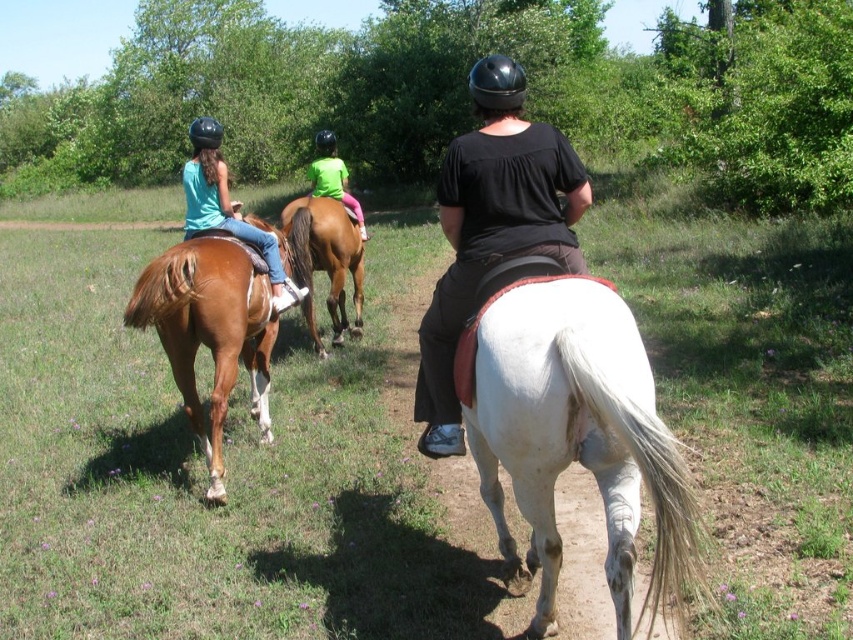
Question: Estimate the real-world distances between objects in this image. Which object is farther from the white smooth horse at center?

Choices:
 (A) brown glossy horse at center
 (B) brown glossy horse at left
 (C) white matte horse at center
 (D) black matte shirt at center

Answer: (A)

Question: Is black matte shirt at center below brown glossy horse at left?

Choices:
 (A) yes
 (B) no

Answer: (B)

Question: Which object is closer to the camera taking this photo?

Choices:
 (A) matte teal shirt at upper left
 (B) black matte shirt at center

Answer: (B)

Question: Does white matte horse at center appear over brown glossy horse at left?

Choices:
 (A) no
 (B) yes

Answer: (B)

Question: Among these objects, which one is nearest to the camera?

Choices:
 (A) black matte shirt at center
 (B) brown glossy horse at center
 (C) matte teal shirt at upper left

Answer: (A)

Question: Does white matte horse at center appear on the right side of brown glossy horse at center?

Choices:
 (A) yes
 (B) no

Answer: (A)